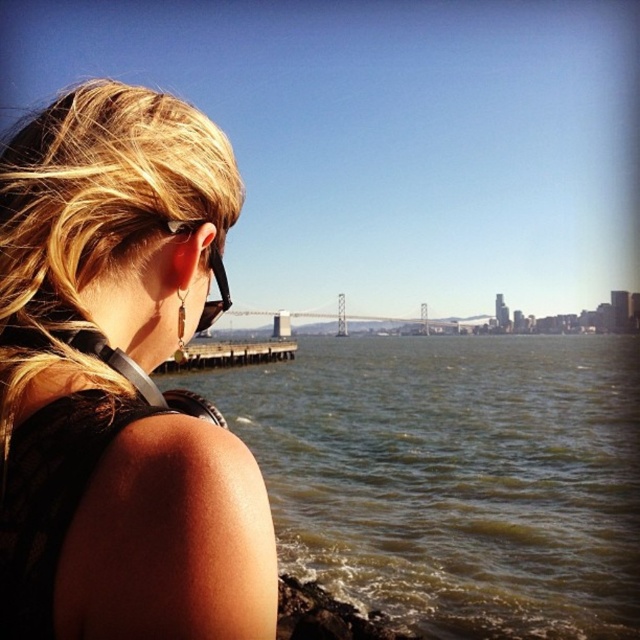
You are a photographer trying to capture the reflection of the black plastic goggles at upper left in the greenish water at lower left. Based on the scene, is this possible?

The greenish water at lower left is positioned under the black plastic goggles at upper left, so the reflection would not be visible since the water is below the goggles.

Based on the scene described, if you were standing where the person is, which object would be on your left side? The blonde hair at upper left or the greenish water at lower left?

The blonde hair at upper left is to the left of the greenish water at lower left, so if you were standing where the person is, the blonde hair at upper left would be on your left side.

You are a photographer wanting to capture the person in the scene. The person is at point (120, 381). Where should you position your camera to ensure the blonde hair at upper left is in the frame?

The blonde hair at upper left is located at point (120, 381), so position your camera to include that coordinate in the frame.